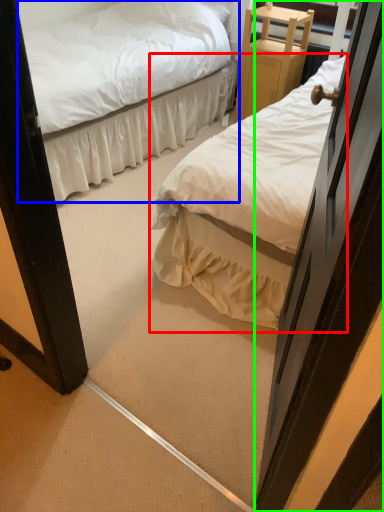
Question: Considering the real-world distances, which object is closest to bed (highlighted by a red box)? bed (highlighted by a blue box) or door (highlighted by a green box).

Choices:
 (A) bed
 (B) door

Answer: (B)